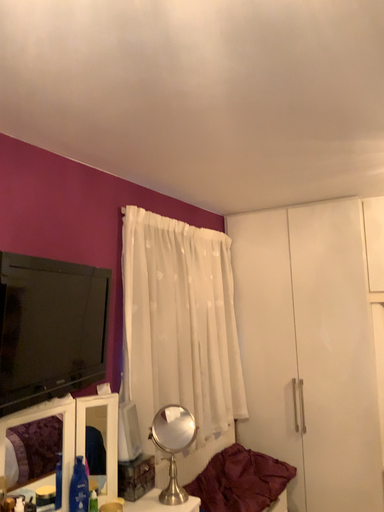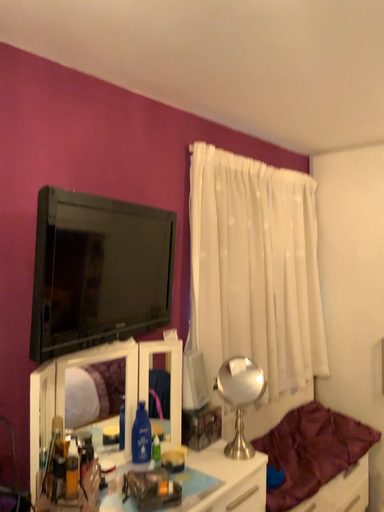
Question: How did the camera likely rotate when shooting the video?

Choices:
 (A) rotated right
 (B) rotated left

Answer: (B)